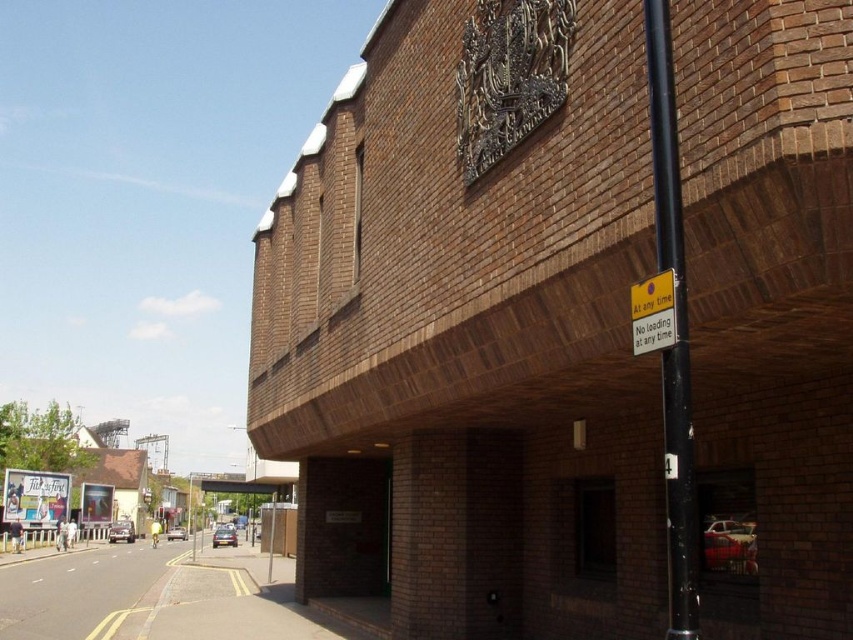
You are a delivery driver who needs to enter the parking garage through the entrance. You see a black metal pole at right and a yellow plastic sign at upper right. Which object is larger in size?

The black metal pole at right is bigger than the yellow plastic sign at upper right, so the black metal pole at right is larger in size.

You are standing in front of the brick building and want to determine the relative positions of two points marked on the facade. Which point, point (656, 99) or point (642, 285), is closer to you?

Point (656, 99) is closer to the viewer than point (642, 285).